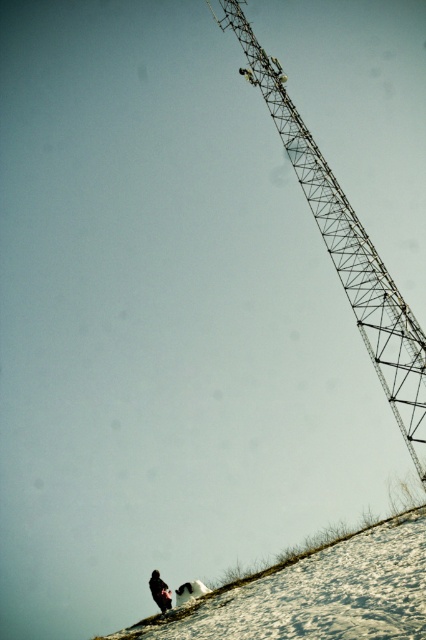
You are a photographer trying to capture the entire scene in one shot. Given that the metallic lattice crane at upper right and the dark fabric jacket at lower center are both in your frame, which object would appear bigger in your photo?

The metallic lattice crane at upper right would appear bigger in the photo because it is larger in size than the dark fabric jacket at lower center.

You are a photographer trying to capture the metallic lattice crane at upper right and the dark fabric jacket at lower center in the same frame. Based on their sizes in the image, which object would appear larger in your photo?

The metallic lattice crane at upper right appears larger in the photo because it is taller than the dark fabric jacket at lower center.

You are standing at point (160, 595) and want to walk to point (276, 124). Which direction should you move relative to the tower?

You should move away from the tower because point (276, 124) is behind the tower relative to your current position at point (160, 595).